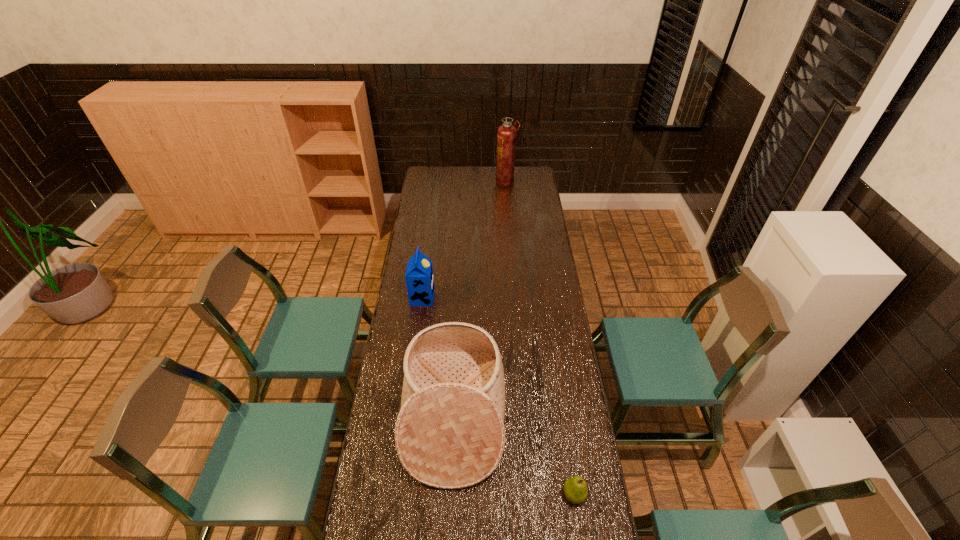
Locate an element on the screen. The height and width of the screenshot is (540, 960). free space between the fire extinguisher and the carton is located at coordinates (464, 240).

What are the coordinates of `object identified as the third closest to the shortest object` in the screenshot? It's located at (506, 133).

Select which object is the third closest to the carton. Please provide its 2D coordinates. Your answer should be formatted as a tuple, i.e. [(x, y)], where the tuple contains the x and y coordinates of a point satisfying the conditions above.

[(506, 133)]

I want to click on blank space that satisfies the following two spatial constraints: 1. on the back side of the rightmost object; 2. with the cap open on the second farthest object, so click(545, 298).

Locate an element on the screen. free space that satisfies the following two spatial constraints: 1. on the side of the third object from left to right with the label; 2. on the left side of the pear is located at coordinates (530, 495).

You are a GUI agent. You are given a task and a screenshot of the screen. Output one action in this format:
    pyautogui.click(x=<x>, y=<y>)
    Task: Click on the vacant space that satisfies the following two spatial constraints: 1. with the cap open on the second farthest object; 2. on the back side of the pear
    
    Given the screenshot: What is the action you would take?
    pyautogui.click(x=397, y=495)

Image resolution: width=960 pixels, height=540 pixels. Identify the location of free location that satisfies the following two spatial constraints: 1. on the side of the third object from left to right with the label; 2. on the back side of the shortest object. (530, 495).

You are a GUI agent. You are given a task and a screenshot of the screen. Output one action in this format:
    pyautogui.click(x=<x>, y=<y>)
    Task: Click on the free space in the image that satisfies the following two spatial constraints: 1. with the lid open on the basket; 2. on the back side of the shortest object
    The height and width of the screenshot is (540, 960).
    Given the screenshot: What is the action you would take?
    pyautogui.click(x=450, y=495)

Find the location of a particular element. This screenshot has height=540, width=960. vacant region that satisfies the following two spatial constraints: 1. on the back side of the shortest object; 2. on the side of the fire extinguisher with the label is located at coordinates (528, 182).

Where is `vacant point that satisfies the following two spatial constraints: 1. with the cap open on the rightmost object; 2. on the left side of the carton`? This screenshot has height=540, width=960. vacant point that satisfies the following two spatial constraints: 1. with the cap open on the rightmost object; 2. on the left side of the carton is located at coordinates (397, 495).